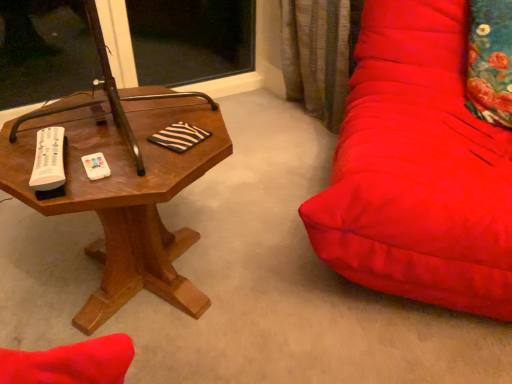
Question: Does woodenobject at left have a greater width compared to floral fabric pillow at right?

Choices:
 (A) no
 (B) yes

Answer: (B)

Question: Is woodenobject at left bigger than floral fabric pillow at right?

Choices:
 (A) no
 (B) yes

Answer: (B)

Question: Are woodenobject at left and floral fabric pillow at right located far from each other?

Choices:
 (A) no
 (B) yes

Answer: (B)

Question: From a real-world perspective, is woodenobject at left on floral fabric pillow at right?

Choices:
 (A) yes
 (B) no

Answer: (B)

Question: Is woodenobject at left smaller than floral fabric pillow at right?

Choices:
 (A) yes
 (B) no

Answer: (B)

Question: Is woodenobject at left not within floral fabric pillow at right?

Choices:
 (A) yes
 (B) no

Answer: (A)

Question: From a real-world perspective, is floral fabric pillow at right positioned over woodenobject at left based on gravity?

Choices:
 (A) yes
 (B) no

Answer: (A)

Question: From a real-world perspective, is floral fabric pillow at right physically below woodenobject at left?

Choices:
 (A) yes
 (B) no

Answer: (B)

Question: Considering the relative sizes of floral fabric pillow at right and woodenobject at left in the image provided, is floral fabric pillow at right wider than woodenobject at left?

Choices:
 (A) yes
 (B) no

Answer: (B)

Question: Could you tell me if floral fabric pillow at right is facing woodenobject at left?

Choices:
 (A) no
 (B) yes

Answer: (A)

Question: From the image's perspective, is floral fabric pillow at right on woodenobject at left?

Choices:
 (A) no
 (B) yes

Answer: (B)

Question: Is floral fabric pillow at right positioned beyond the bounds of woodenobject at left?

Choices:
 (A) no
 (B) yes

Answer: (B)

Question: In terms of size, does floral fabric pillow at right appear bigger or smaller than woodenobject at left?

Choices:
 (A) big
 (B) small

Answer: (B)